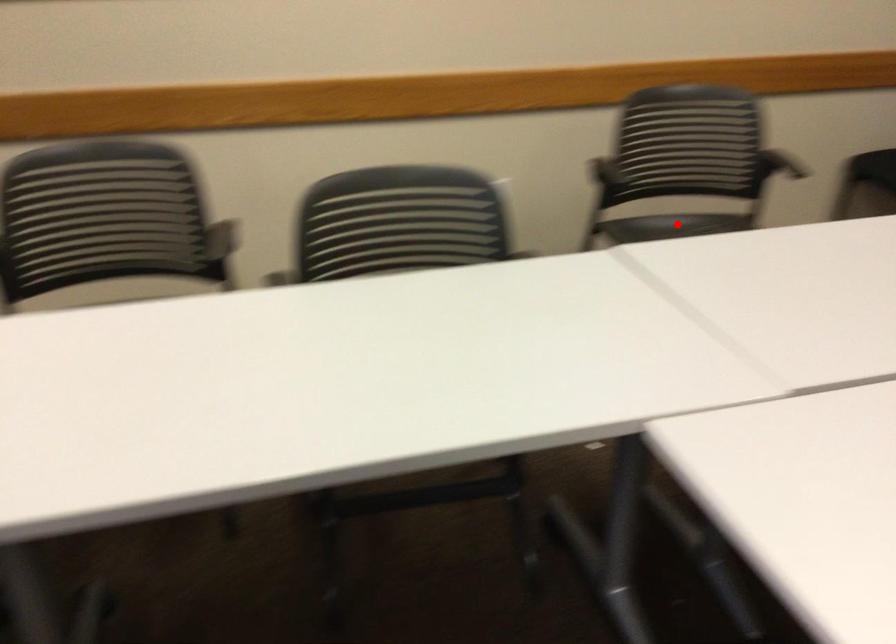
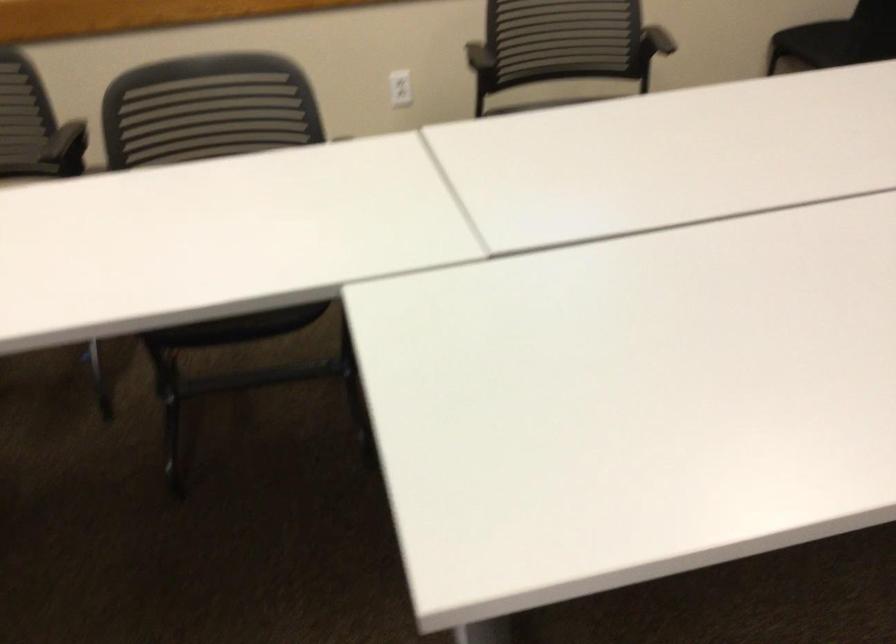
Question: I am providing you with two images of the same scene from different viewpoints. A red point is marked on the first image. Is the red point's position out of view in image 2?

Choices:
 (A) Yes
 (B) No

Answer: (A)